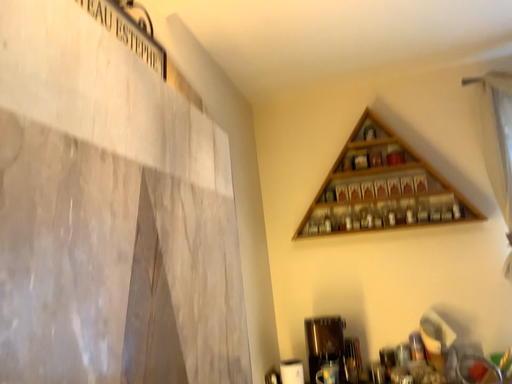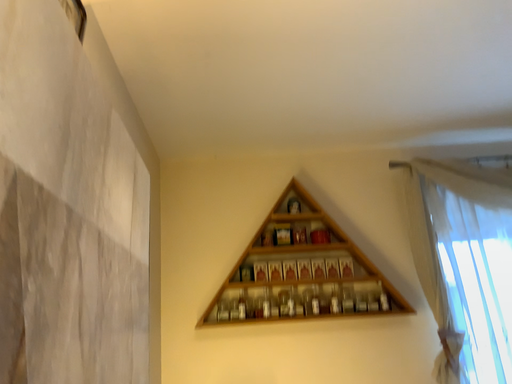
Question: Which way did the camera rotate in the video?

Choices:
 (A) rotated upward
 (B) rotated downward

Answer: (A)